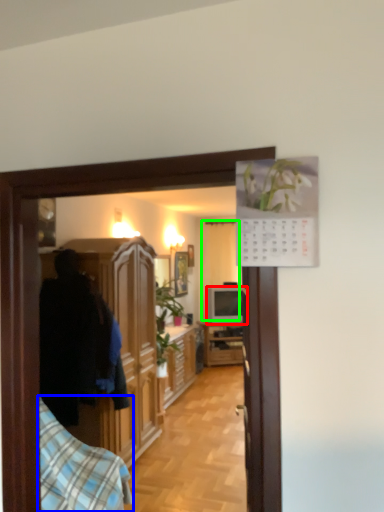
Question: Which is nearer to the television (highlighted by a red box)? bedding (highlighted by a blue box) or curtain (highlighted by a green box).

Choices:
 (A) bedding
 (B) curtain

Answer: (B)